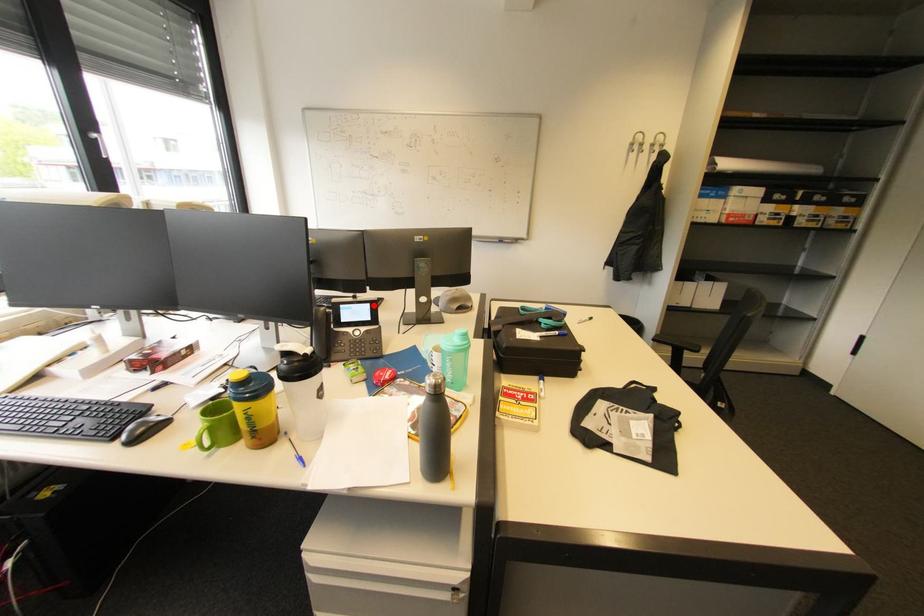
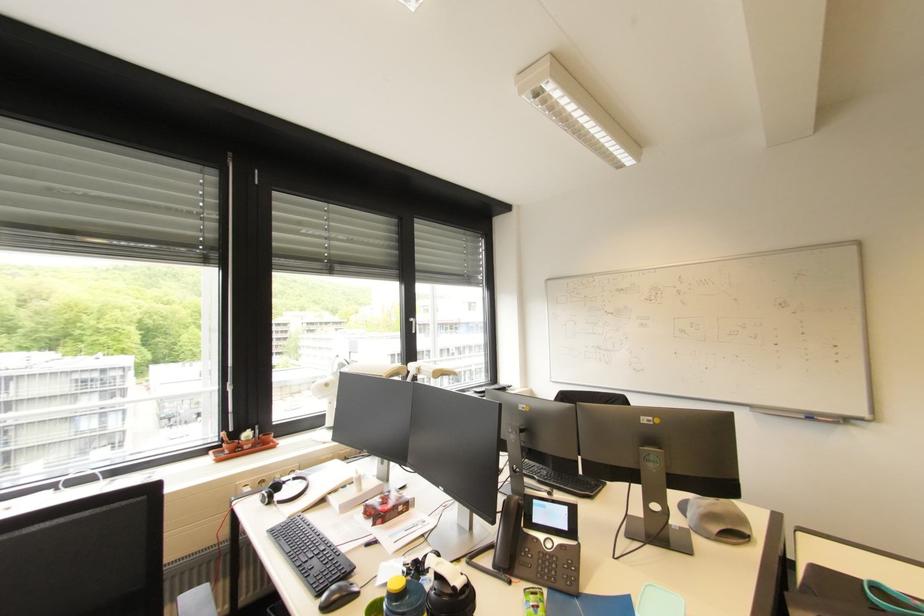
Find the pixel in the second image that matches the highlighted location in the first image.

(572, 509)